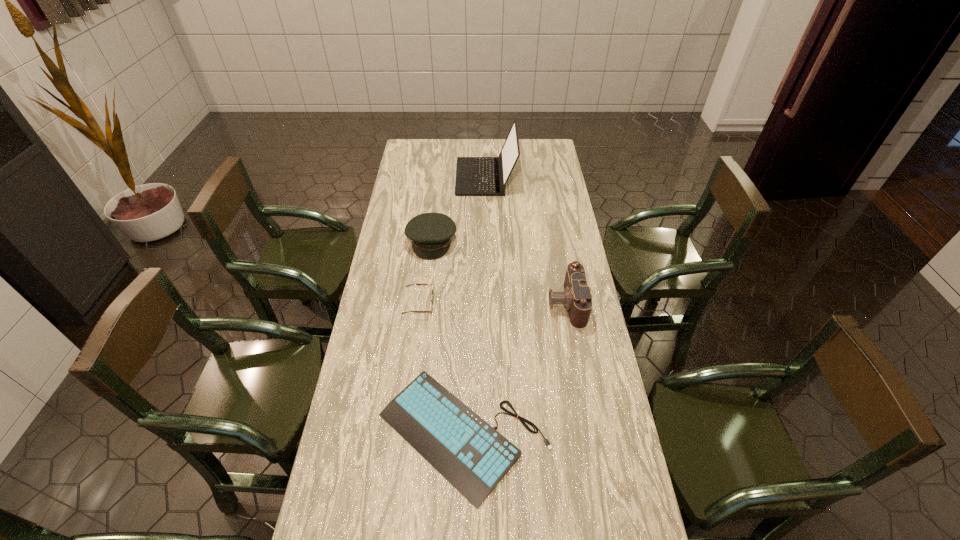
The image size is (960, 540). What are the coordinates of `spectacles that is positioned at the left edge` in the screenshot? It's located at (432, 297).

At what (x,y) coordinates should I click in order to perform the action: click on computer keyboard that is at the left edge. Please return your answer as a coordinate pair (x, y). Looking at the image, I should click on (473, 456).

The height and width of the screenshot is (540, 960). In order to click on object at the right edge in this screenshot , I will do `click(576, 297)`.

The image size is (960, 540). Find the location of `blank area at the far edge`. blank area at the far edge is located at coordinates (517, 162).

In the image, there is a desktop. In order to click on vacant space at the left edge in this screenshot , I will do `click(409, 214)`.

This screenshot has width=960, height=540. Identify the location of vacant space at the right edge. (567, 233).

At what (x,y) coordinates should I click in order to perform the action: click on vacant space at the far left corner of the desktop. Please return your answer as a coordinate pair (x, y). The image size is (960, 540). Looking at the image, I should click on (402, 155).

Where is `vacant space that is in between the spectacles and the computer keyboard`? The width and height of the screenshot is (960, 540). vacant space that is in between the spectacles and the computer keyboard is located at coordinates (441, 369).

Find the location of a particular element. This screenshot has width=960, height=540. vacant area between the laptop and the rightmost object is located at coordinates [526, 240].

Locate an element on the screen. The width and height of the screenshot is (960, 540). free space that is in between the second tallest object and the tallest object is located at coordinates (526, 240).